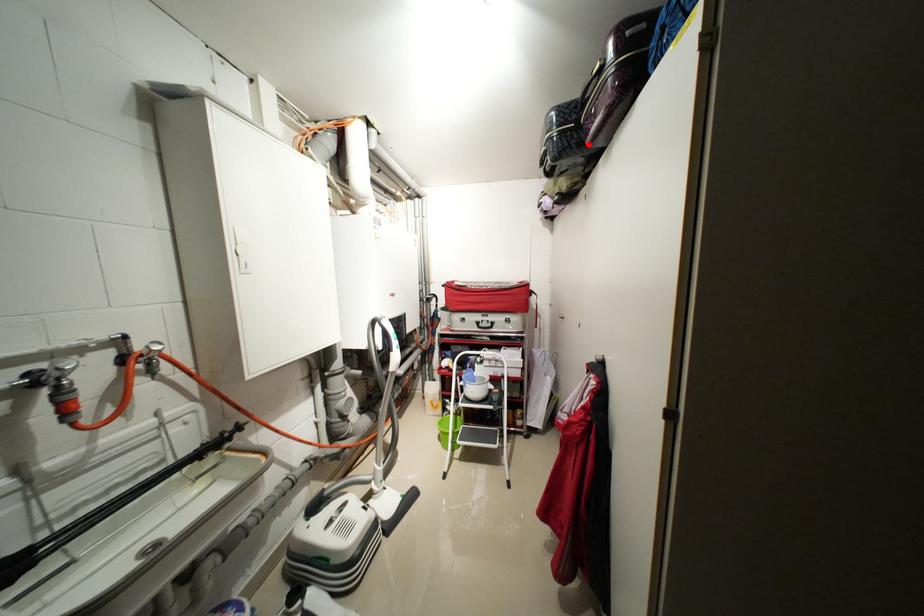
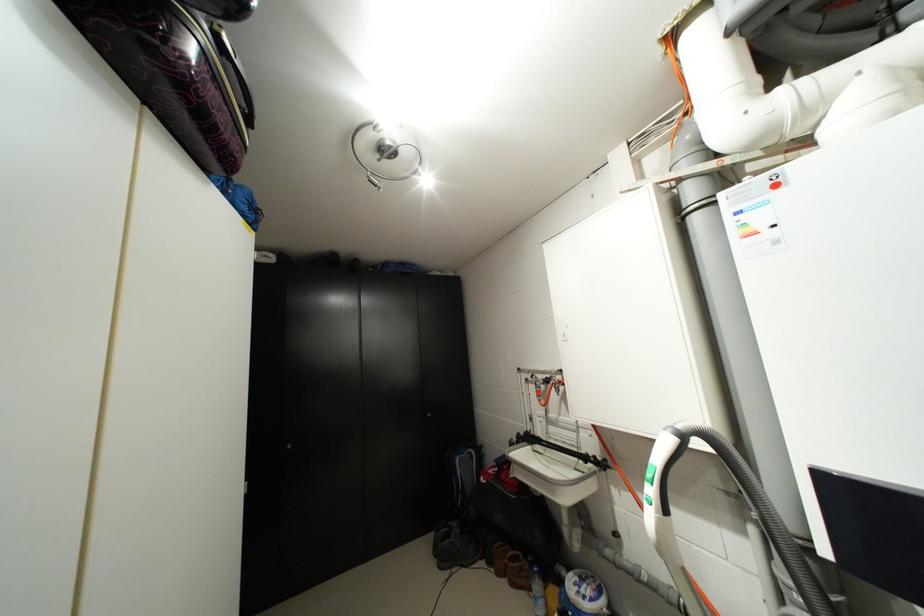
In the second image, find the point that corresponds to the highlighted location in the first image.

(189, 42)